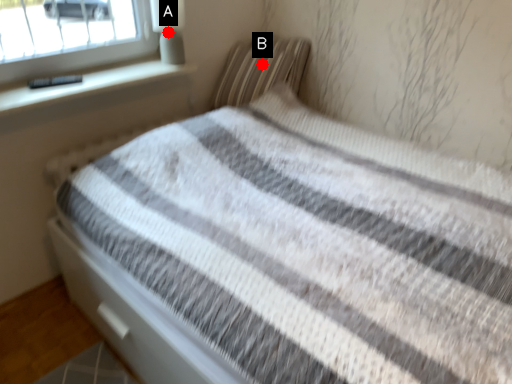
Question: Two points are circled on the image, labeled by A and B beside each circle. Which point is closer to the camera?

Choices:
 (A) A is closer
 (B) B is closer

Answer: (A)